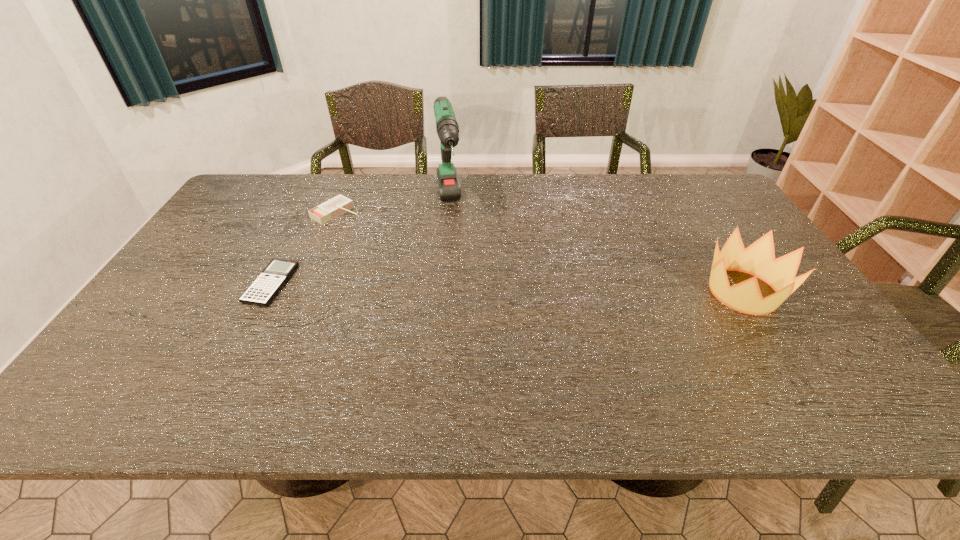
You are a GUI agent. You are given a task and a screenshot of the screen. Output one action in this format:
    pyautogui.click(x=<x>, y=<y>)
    Task: Click on the vacant space on the desktop that is between the shortest object and the second tallest object and is positioned on the striking surface of the matchbox
    This screenshot has height=540, width=960.
    Given the screenshot: What is the action you would take?
    pyautogui.click(x=471, y=287)

At what (x,y) coordinates should I click in order to perform the action: click on vacant space on the desktop that is between the shortest object and the rightmost object and is positioned on the handle side of the drill. Please return your answer as a coordinate pair (x, y). The image size is (960, 540). Looking at the image, I should click on (463, 287).